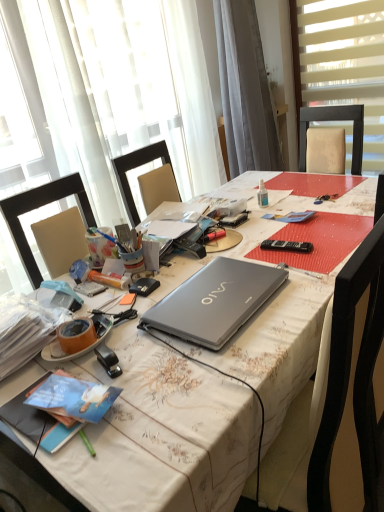
This screenshot has width=384, height=512. Identify the location of vacant space behind black plastic stapler at lower left. (127, 332).